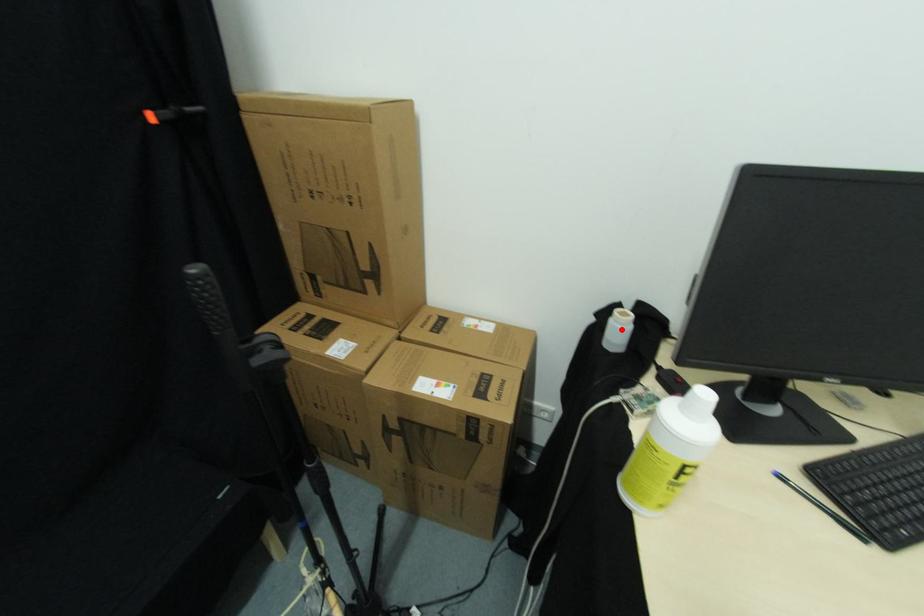
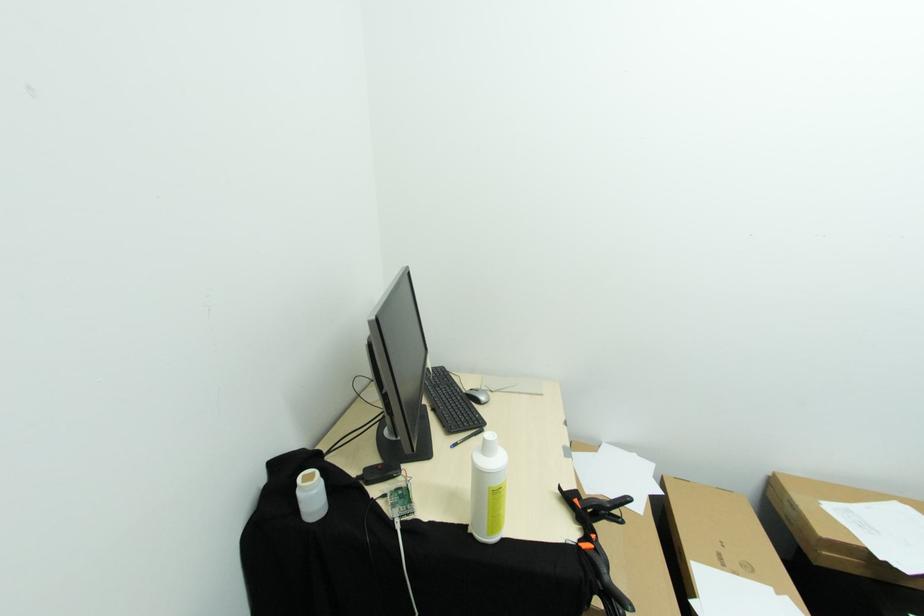
In the second image, find the point that corresponds to the highlighted location in the first image.

(314, 495)